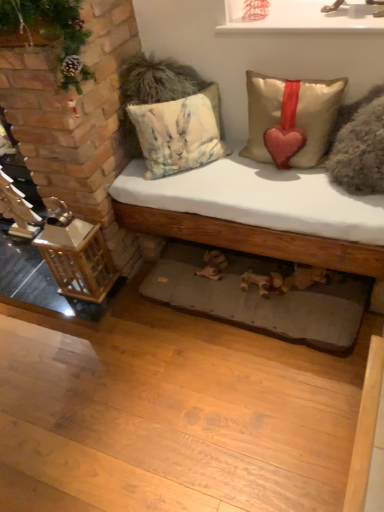
Where is `free space to the left of gray fabric mat at lower center`? free space to the left of gray fabric mat at lower center is located at coordinates (108, 372).